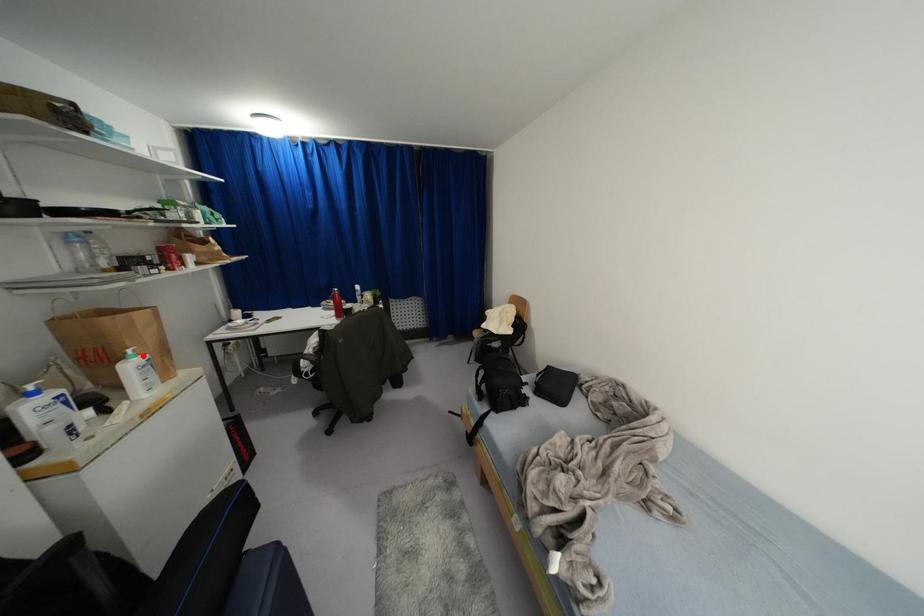
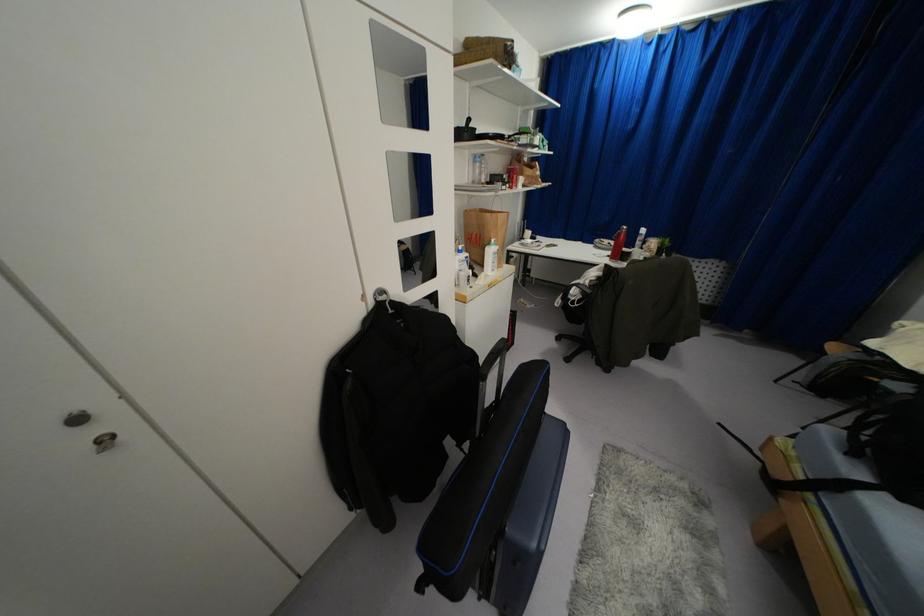
Question: I am providing you with two images of the same scene from different viewpoints. Given a red point in image1, look at the same physical point in image2. Is it:

Choices:
 (A) Closer to the viewpoint
 (B) Farther from the viewpoint

Answer: (A)